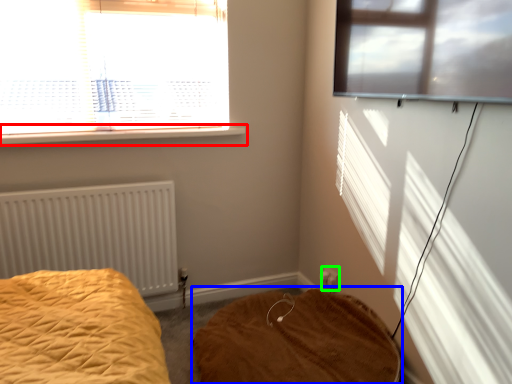
Question: Based on their relative distances, which object is nearer to window sill (highlighted by a red box)? Choose from mattress (highlighted by a blue box) and electric outlet (highlighted by a green box).

Choices:
 (A) mattress
 (B) electric outlet

Answer: (A)